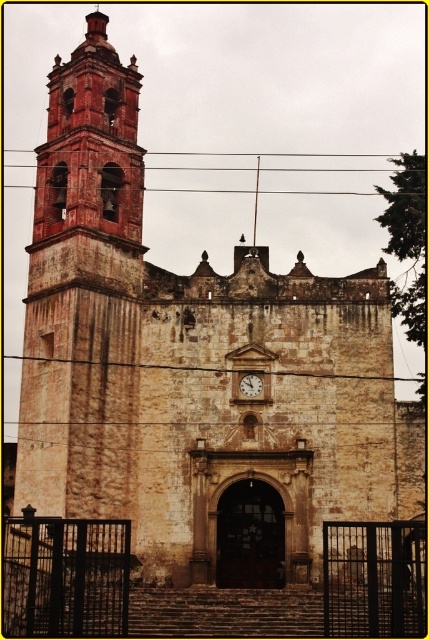
You are standing at the base of the historic stone church and want to reach the point marked as point (210, 170). If your walking speed is 3 feet per second, how long will it take you to reach that point?

The distance between you and point (210, 170) is 342.20 feet. At a walking speed of 3 feet per second, it will take approximately 114 seconds to reach the point.

You are an electrician inspecting the historic stone church. You notice the brown wire at upper center and the wooden clock at center. Which object is bigger in size?

The brown wire at upper center is larger in size compared to the wooden clock at center according to the description.

Looking at this image, you are standing 200 feet away from the brown wire at upper center. Can you reach it without moving closer?

The brown wire at upper center is 256.38 feet away from the viewer. Since you are standing 200 feet away, you are still 56.38 feet away from it, so you cannot reach it without moving closer.